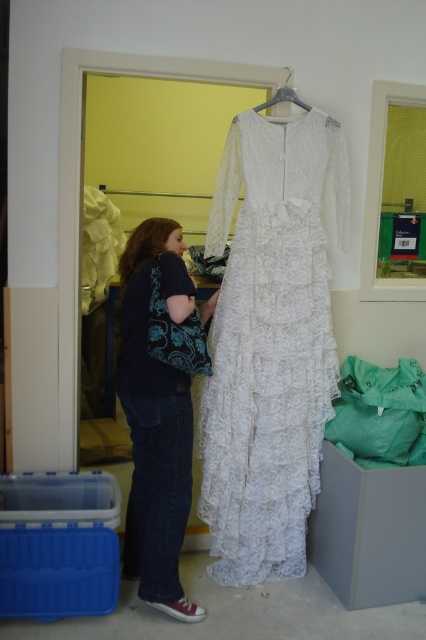
Question: Among these points, which one is farthest from the camera?

Choices:
 (A) (135, 323)
 (B) (273, 337)

Answer: (B)

Question: Does white lace dress at center have a lesser width compared to black cotton shirt at left?

Choices:
 (A) no
 (B) yes

Answer: (A)

Question: Considering the relative positions of white lace dress at center and black cotton shirt at left in the image provided, where is white lace dress at center located with respect to black cotton shirt at left?

Choices:
 (A) above
 (B) below

Answer: (A)

Question: Which point appears farthest from the camera in this image?

Choices:
 (A) (328, 289)
 (B) (164, 397)

Answer: (A)

Question: Which object appears farthest from the camera in this image?

Choices:
 (A) black cotton shirt at left
 (B) white lace dress at center

Answer: (B)

Question: In this image, where is white lace dress at center located relative to black cotton shirt at left?

Choices:
 (A) left
 (B) right

Answer: (B)